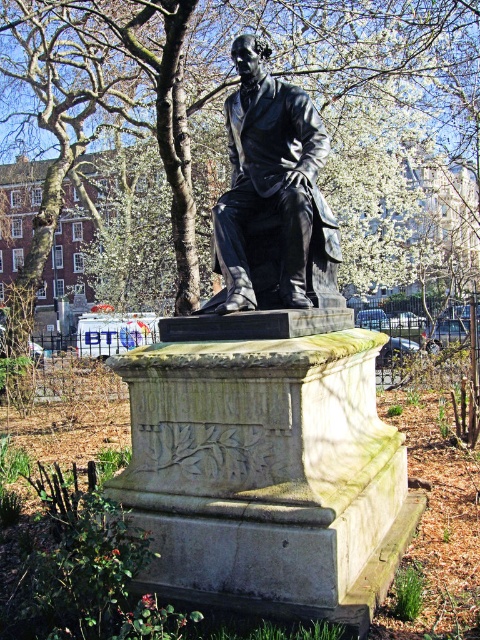
Is point (441, 186) in front of point (252, 81)?

No.

Can you confirm if green leafy tree at upper left is positioned to the left of black polished statue at center?

Indeed, green leafy tree at upper left is positioned on the left side of black polished statue at center.

What do you see at coordinates (226, 140) in the screenshot? Image resolution: width=480 pixels, height=640 pixels. I see `green leafy tree at upper left` at bounding box center [226, 140].

Find the location of a particular element. The height and width of the screenshot is (640, 480). green leafy tree at upper left is located at coordinates (226, 140).

Which is in front, point (152, 17) or point (228, 228)?

Positioned in front is point (228, 228).

Can you confirm if green leafy tree at upper left is smaller than polished bronze statue at center?

Actually, green leafy tree at upper left might be larger than polished bronze statue at center.

Between point (170, 10) and point (309, 353), which one is positioned in front?

Point (309, 353) is more forward.

Where is `green leafy tree at upper left`? This screenshot has width=480, height=640. green leafy tree at upper left is located at coordinates (226, 140).

From the picture: Which of these two, polished bronze statue at center or black polished statue at center, stands taller?

polished bronze statue at center

Find the location of `polished bronze statue at center`. polished bronze statue at center is located at coordinates (267, 397).